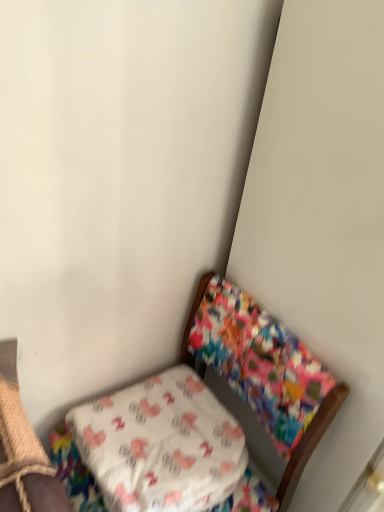
Question: Considering the relative positions of floral fabric chair at lower right and white fabric pillow at lower left in the image provided, is floral fabric chair at lower right to the left of white fabric pillow at lower left from the viewer's perspective?

Choices:
 (A) no
 (B) yes

Answer: (A)

Question: Considering the relative sizes of floral fabric chair at lower right and white fabric pillow at lower left in the image provided, is floral fabric chair at lower right shorter than white fabric pillow at lower left?

Choices:
 (A) yes
 (B) no

Answer: (B)

Question: From a real-world perspective, does floral fabric chair at lower right sit lower than white fabric pillow at lower left?

Choices:
 (A) yes
 (B) no

Answer: (A)

Question: Is floral fabric chair at lower right outside of white fabric pillow at lower left?

Choices:
 (A) yes
 (B) no

Answer: (A)

Question: Considering the relative sizes of floral fabric chair at lower right and white fabric pillow at lower left in the image provided, is floral fabric chair at lower right taller than white fabric pillow at lower left?

Choices:
 (A) no
 (B) yes

Answer: (B)

Question: From the image's perspective, does floral fabric chair at lower right appear higher than white fabric pillow at lower left?

Choices:
 (A) no
 (B) yes

Answer: (A)

Question: Could floral fabric chair at lower right be considered to be inside white fabric pillow at lower left?

Choices:
 (A) no
 (B) yes

Answer: (A)

Question: Is white fabric pillow at lower left with floral fabric chair at lower right?

Choices:
 (A) no
 (B) yes

Answer: (B)

Question: From the image's perspective, does white fabric pillow at lower left appear lower than floral fabric chair at lower right?

Choices:
 (A) yes
 (B) no

Answer: (B)

Question: Can you confirm if white fabric pillow at lower left is positioned to the left of floral fabric chair at lower right?

Choices:
 (A) yes
 (B) no

Answer: (A)

Question: Is white fabric pillow at lower left not near floral fabric chair at lower right?

Choices:
 (A) yes
 (B) no

Answer: (B)

Question: From a real-world perspective, is white fabric pillow at lower left positioned over floral fabric chair at lower right based on gravity?

Choices:
 (A) no
 (B) yes

Answer: (B)

Question: In terms of height, does floral fabric chair at lower right look taller or shorter compared to white fabric pillow at lower left?

Choices:
 (A) tall
 (B) short

Answer: (A)